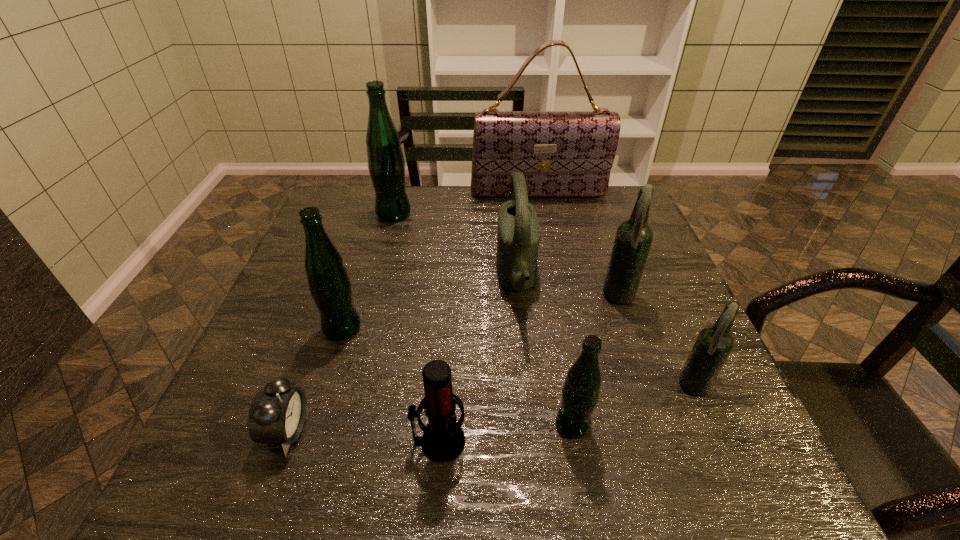
This screenshot has width=960, height=540. Find the location of `alarm clock located at the left edge`. alarm clock located at the left edge is located at coordinates (277, 415).

The image size is (960, 540). Find the location of `handbag present at the right edge`. handbag present at the right edge is located at coordinates (561, 153).

The width and height of the screenshot is (960, 540). What are the coordinates of `object located at the near left corner` in the screenshot? It's located at (277, 415).

Identify the location of object that is positioned at the far right corner. The width and height of the screenshot is (960, 540). (561, 153).

In the image, there is a desktop. At what (x,y) coordinates should I click in order to perform the action: click on free space at the far edge. Please return your answer as a coordinate pair (x, y). The image size is (960, 540). Looking at the image, I should click on (465, 194).

In the image, there is a desktop. Where is `vacant region at the near edge`? vacant region at the near edge is located at coordinates (514, 461).

I want to click on free space at the left edge of the desktop, so click(324, 359).

Locate an element on the screen. This screenshot has width=960, height=540. vacant space at the right edge of the desktop is located at coordinates click(x=638, y=311).

This screenshot has width=960, height=540. In the image, there is a desktop. Identify the location of vacant space at the far right corner. (x=620, y=191).

Where is `vacant area that lies between the farthest beer bottle and the farthest object`? This screenshot has width=960, height=540. vacant area that lies between the farthest beer bottle and the farthest object is located at coordinates (467, 204).